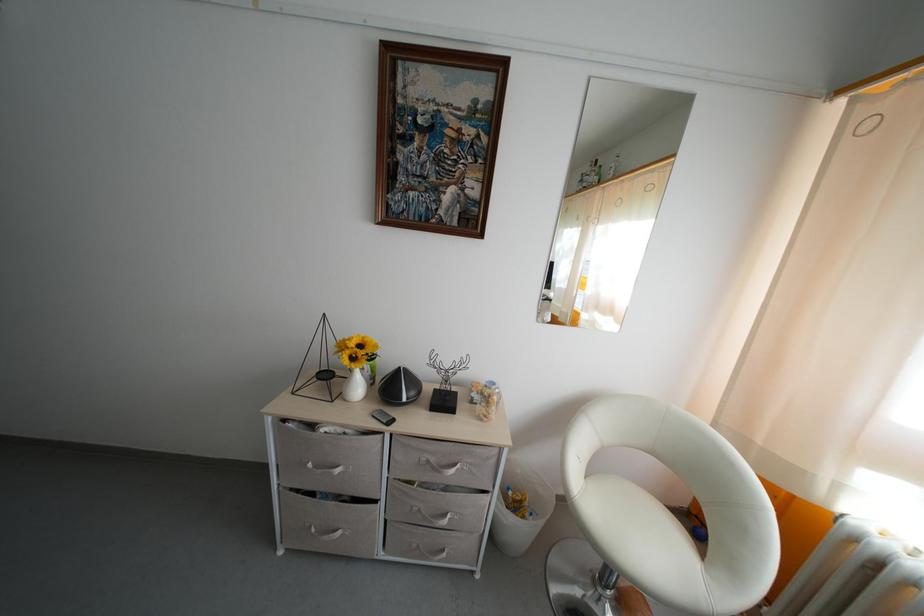
Find where to sit the chair sitting surface. Please return your answer as a coordinate pair (x, y).

(630, 523)